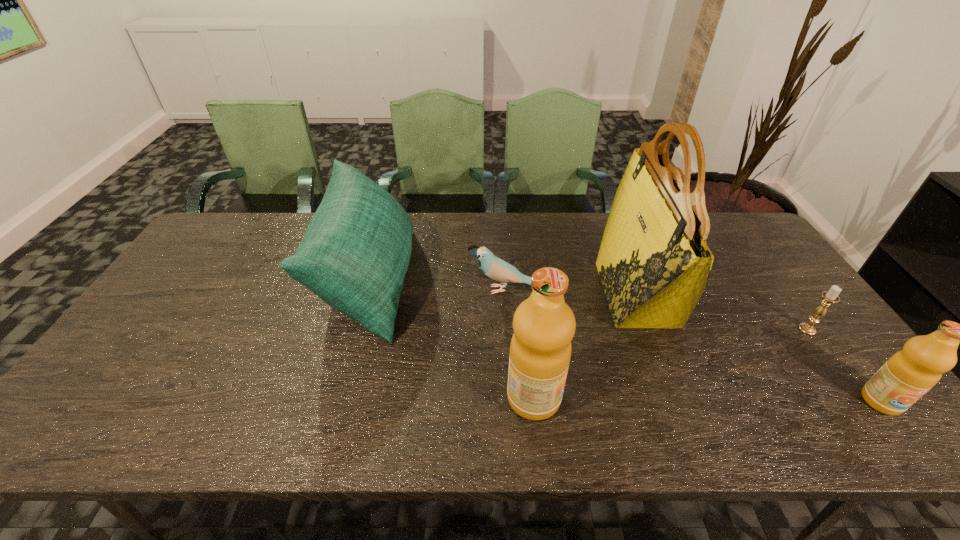
Locate an element on the screen. the second tallest object is located at coordinates (544, 325).

Identify the location of the left fruit juice. (544, 325).

What are the coordinates of `the right fruit juice` in the screenshot? It's located at (907, 375).

You are a GUI agent. You are given a task and a screenshot of the screen. Output one action in this format:
    pyautogui.click(x=<x>, y=<y>)
    Task: Click on the leftmost object
    The width and height of the screenshot is (960, 540).
    Given the screenshot: What is the action you would take?
    pyautogui.click(x=354, y=256)

This screenshot has height=540, width=960. I want to click on candle holder, so click(831, 296).

Identify the location of tote bag. The height and width of the screenshot is (540, 960). (654, 264).

Identify the location of the fourth object from left to right. (654, 264).

The image size is (960, 540). What are the coordinates of `bird` in the screenshot? It's located at (497, 269).

This screenshot has height=540, width=960. Find the location of `blank area located on the front label of the left fruit juice`. blank area located on the front label of the left fruit juice is located at coordinates (617, 398).

Locate an element on the screen. This screenshot has height=540, width=960. vacant space located 0.360m on the front-facing side of the leftmost object is located at coordinates (535, 281).